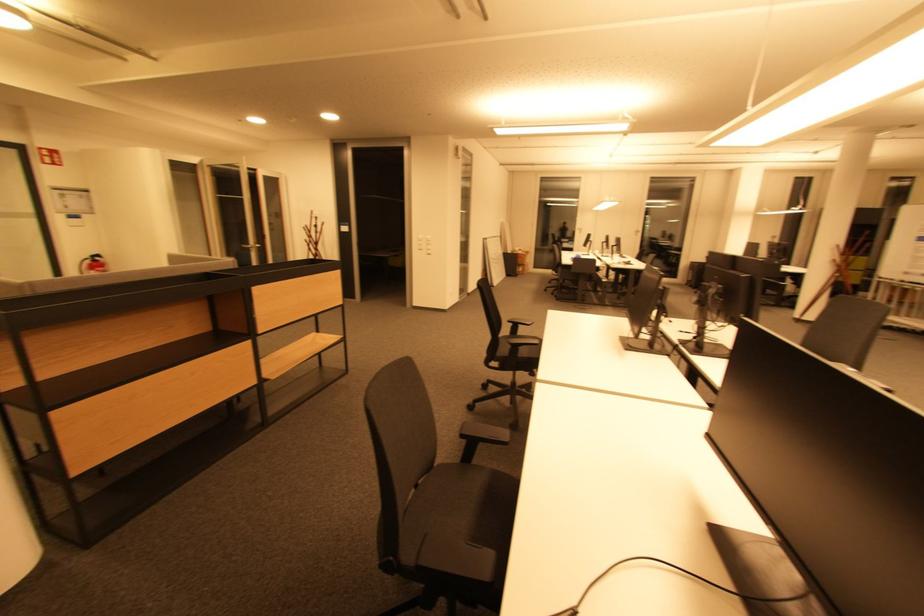
The image size is (924, 616). Find the location of `black chair sitting surface`. black chair sitting surface is located at coordinates (480, 500).